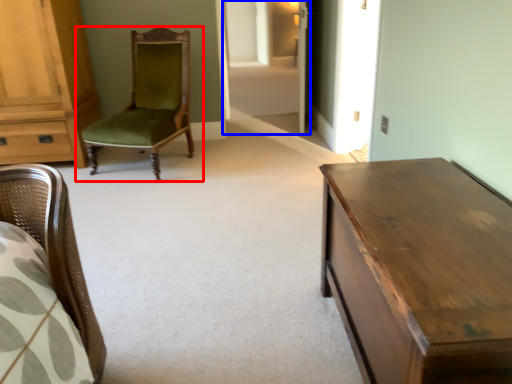
Question: Which point is closer to the camera, chair (highlighted by a red box) or glass door (highlighted by a blue box)?

Choices:
 (A) chair
 (B) glass door

Answer: (A)